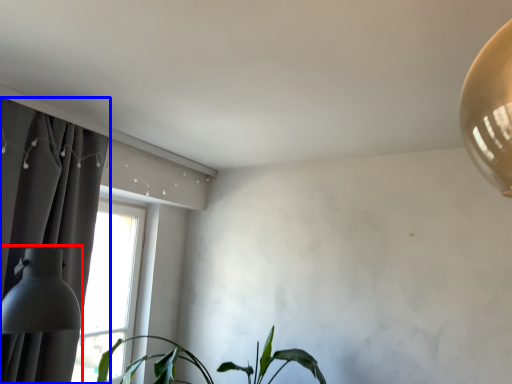
Question: Which object is closer to the camera taking this photo, table lamp (highlighted by a red box) or curtain (highlighted by a blue box)?

Choices:
 (A) table lamp
 (B) curtain

Answer: (A)